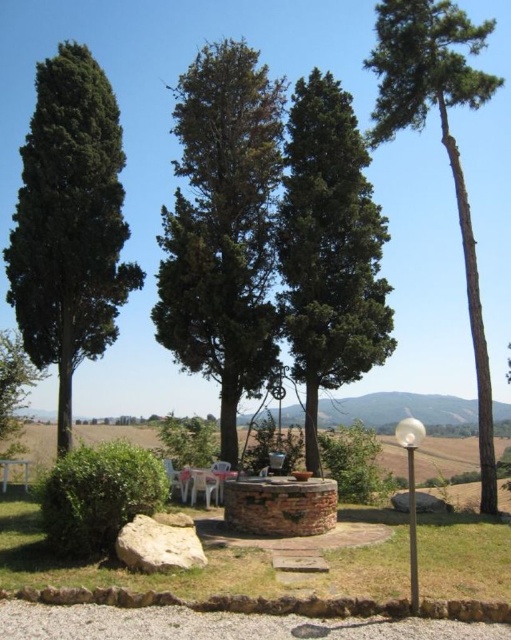
You are standing at the camera position and want to reach point (65, 157). Is the distance less than 20 meters?

The distance between you and point (65, 157) is 17.96 meters, which is less than 20 meters.